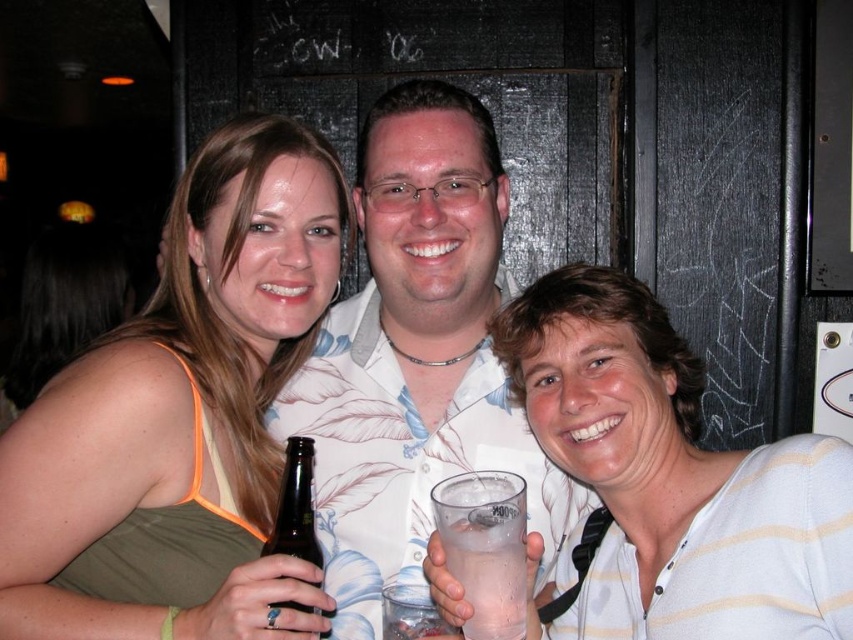
You are standing in front of the door in the background. You want to hand a drink to the person wearing the white striped shirt at center. Which direction should you move to reach them?

Since the white striped shirt at center is positioned at coordinates 0.753 on the x and 0.785 on the y axis, you should move towards the center of the image to reach them.

Based on the photo, you are a photographer adjusting the lighting for a group photo. The green fabric tank top at left and the brown glass bottle at lower left are in the frame. Which object should you focus on first if you want to highlight the larger one?

The green fabric tank top at left has a larger size compared to the brown glass bottle at lower left, so you should focus on the green fabric tank top at left first to highlight the larger one.